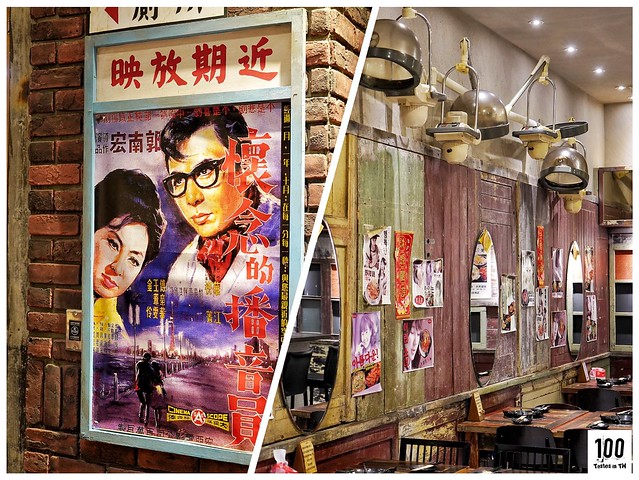
Locate an element on the screen. The image size is (639, 480). 3rd hairdryer is located at coordinates (566, 175).